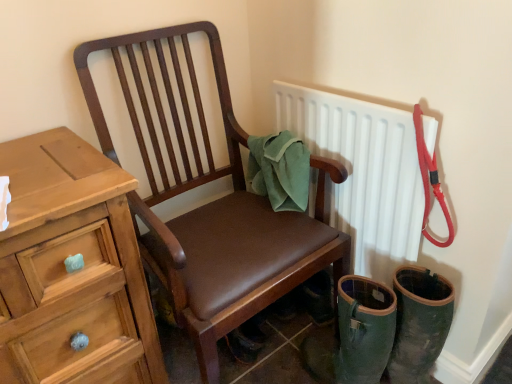
Question: Does brown leather chair at center come in front of white matte radiator at upper right?

Choices:
 (A) yes
 (B) no

Answer: (A)

Question: From a real-world perspective, is brown leather chair at center on top of white matte radiator at upper right?

Choices:
 (A) yes
 (B) no

Answer: (B)

Question: Can you confirm if brown leather chair at center is bigger than white matte radiator at upper right?

Choices:
 (A) no
 (B) yes

Answer: (B)

Question: Would you say brown leather chair at center is outside white matte radiator at upper right?

Choices:
 (A) no
 (B) yes

Answer: (B)

Question: Would you say brown leather chair at center contains white matte radiator at upper right?

Choices:
 (A) no
 (B) yes

Answer: (A)

Question: Does point (328, 246) appear closer or farther from the camera than point (274, 180)?

Choices:
 (A) closer
 (B) farther

Answer: (A)

Question: From a real-world perspective, is brown leather chair at center above or below green fabric towel at chair back?

Choices:
 (A) above
 (B) below

Answer: (B)

Question: Considering their positions, is brown leather chair at center located in front of or behind green fabric towel at chair back?

Choices:
 (A) behind
 (B) front

Answer: (B)

Question: Considering the positions of brown leather chair at center and green fabric towel at chair back in the image, is brown leather chair at center wider or thinner than green fabric towel at chair back?

Choices:
 (A) wide
 (B) thin

Answer: (A)

Question: Which is correct: white matte radiator at upper right is inside wooden chest of drawers at left, or outside of it?

Choices:
 (A) outside
 (B) inside

Answer: (A)

Question: Considering the relative positions of white matte radiator at upper right and wooden chest of drawers at left in the image provided, is white matte radiator at upper right to the left or to the right of wooden chest of drawers at left?

Choices:
 (A) right
 (B) left

Answer: (A)

Question: In terms of height, does white matte radiator at upper right look taller or shorter compared to wooden chest of drawers at left?

Choices:
 (A) short
 (B) tall

Answer: (A)

Question: From the image's perspective, is white matte radiator at upper right positioned above or below wooden chest of drawers at left?

Choices:
 (A) above
 (B) below

Answer: (A)

Question: In terms of size, does wooden chest of drawers at left appear bigger or smaller than green fabric towel at chair back?

Choices:
 (A) small
 (B) big

Answer: (B)

Question: In terms of width, does wooden chest of drawers at left look wider or thinner when compared to green fabric towel at chair back?

Choices:
 (A) thin
 (B) wide

Answer: (B)